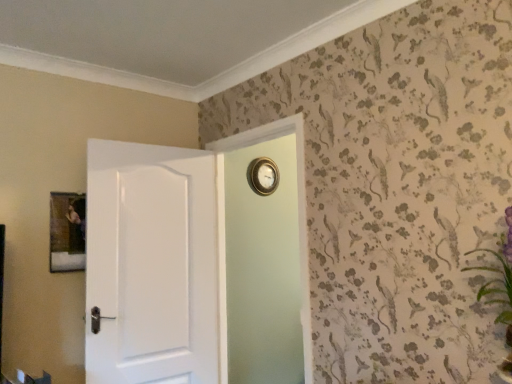
Question: Does wooden picture frame at upper left have a lesser height compared to white glossy door at left?

Choices:
 (A) yes
 (B) no

Answer: (A)

Question: Is wooden picture frame at upper left aimed at white glossy door at left?

Choices:
 (A) no
 (B) yes

Answer: (B)

Question: Is wooden picture frame at upper left far away from white glossy door at left?

Choices:
 (A) no
 (B) yes

Answer: (A)

Question: Is wooden picture frame at upper left completely or partially outside of white glossy door at left?

Choices:
 (A) no
 (B) yes

Answer: (B)

Question: Considering the relative sizes of wooden picture frame at upper left and white glossy door at left in the image provided, is wooden picture frame at upper left wider than white glossy door at left?

Choices:
 (A) yes
 (B) no

Answer: (B)

Question: Does point (487, 294) appear closer or farther from the camera than point (55, 213)?

Choices:
 (A) closer
 (B) farther

Answer: (A)

Question: Based on their positions, is green textured plant at upper right located to the left or right of wooden picture frame at upper left?

Choices:
 (A) left
 (B) right

Answer: (B)

Question: Considering the positions of green textured plant at upper right and wooden picture frame at upper left in the image, is green textured plant at upper right bigger or smaller than wooden picture frame at upper left?

Choices:
 (A) big
 (B) small

Answer: (A)

Question: From the image's perspective, is green textured plant at upper right located above or below wooden picture frame at upper left?

Choices:
 (A) above
 (B) below

Answer: (B)

Question: Would you say wooden picture frame at upper left is inside or outside gold metallic clock at upper center?

Choices:
 (A) outside
 (B) inside

Answer: (A)

Question: In terms of size, does wooden picture frame at upper left appear bigger or smaller than gold metallic clock at upper center?

Choices:
 (A) big
 (B) small

Answer: (B)

Question: Is wooden picture frame at upper left to the left or to the right of gold metallic clock at upper center in the image?

Choices:
 (A) left
 (B) right

Answer: (A)

Question: Is wooden picture frame at upper left in front of or behind gold metallic clock at upper center in the image?

Choices:
 (A) front
 (B) behind

Answer: (B)

Question: In the image, is gold metallic clock at upper center on the left side or the right side of wooden picture frame at upper left?

Choices:
 (A) right
 (B) left

Answer: (A)

Question: From a real-world perspective, is gold metallic clock at upper center physically located above or below wooden picture frame at upper left?

Choices:
 (A) above
 (B) below

Answer: (A)